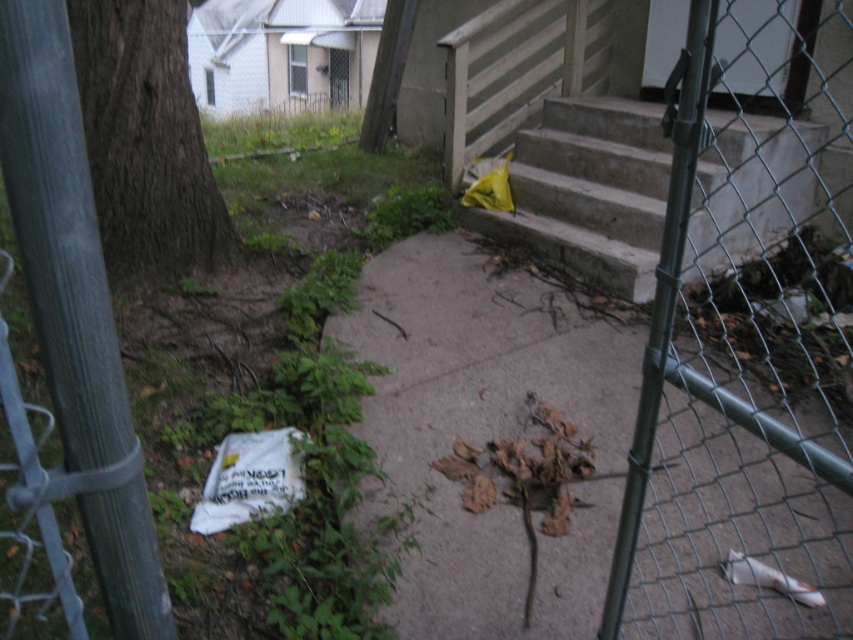
You are a delivery person carrying a package and need to walk from the concrete stairs at center to the brown rough bark tree at left. How much distance do you need to cover?

The distance between the concrete stairs at center and the brown rough bark tree at left is 1.85 meters, so you need to cover 1.85 meters.

You are standing at the entrance of the residential area and see the brown dirt pavement at center and the brown rough bark tree at left. Which one appears bigger in the image?

The brown dirt pavement at center has a larger size compared to the brown rough bark tree at left, so the brown dirt pavement at center appears bigger in the image.

You are a delivery person trying to navigate to the front door. You see the concrete stairs at center and the brown rough bark tree at left. Which object is larger in size?

The concrete stairs at center is bigger than brown rough bark tree at left, so the concrete stairs at center is larger in size.